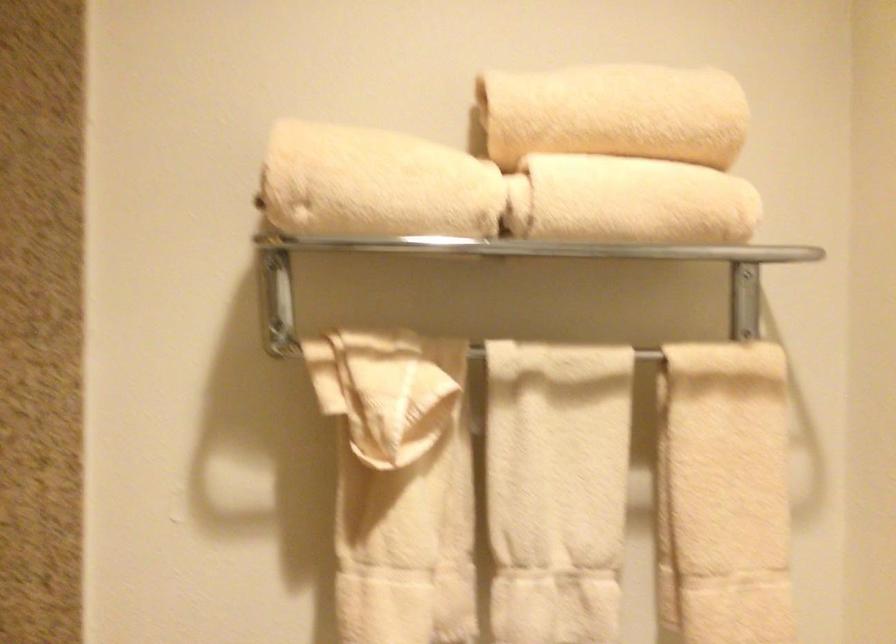
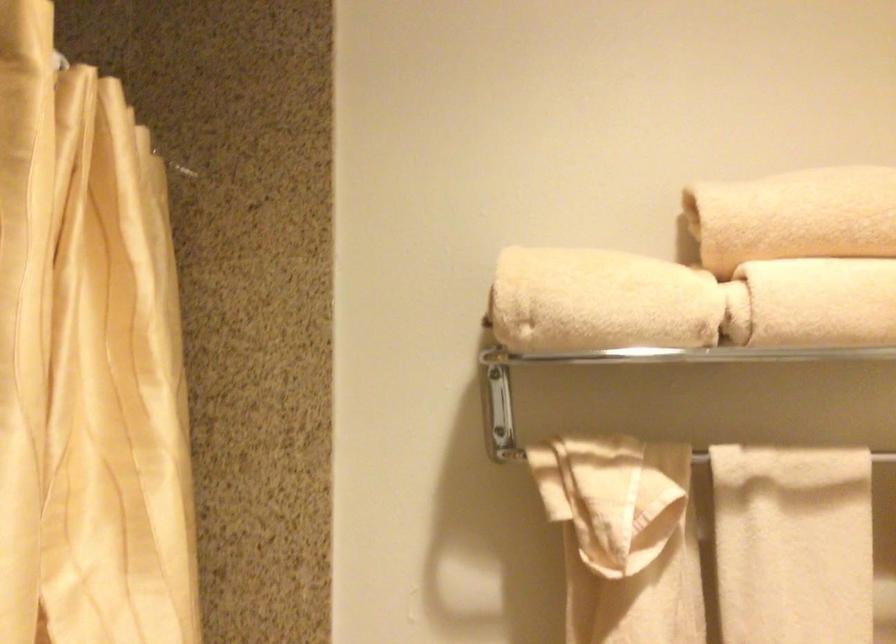
Question: The camera is either moving clockwise (left) or counter-clockwise (right) around the object. The first image is from the beginning of the video and the second image is from the end. Is the camera moving left or right when shooting the video?

Choices:
 (A) Left
 (B) Right

Answer: (B)